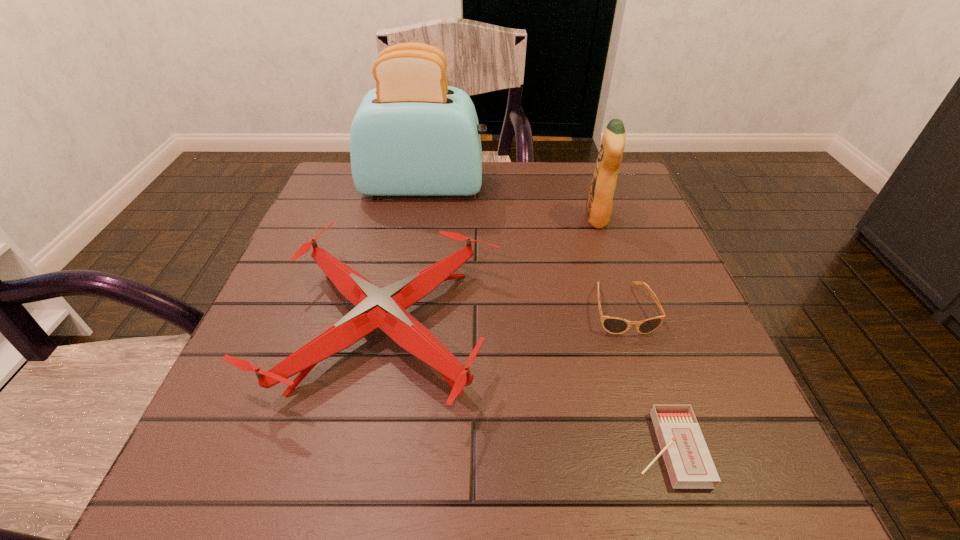
At what (x,y) coordinates should I click in order to perform the action: click on free space located 0.050m on the label of the second tallest object. Please return your answer as a coordinate pair (x, y). The image size is (960, 540). Looking at the image, I should click on (564, 218).

The height and width of the screenshot is (540, 960). What are the coordinates of `free region located on the back of the drone` in the screenshot? It's located at (411, 206).

Find the location of `blank space located on the front-facing side of the sunglasses`. blank space located on the front-facing side of the sunglasses is located at coordinates [682, 495].

This screenshot has height=540, width=960. I want to click on free space located on the striking surface of the matchbox, so click(493, 448).

Locate an element on the screen. vacant space located 0.230m on the striking surface of the matchbox is located at coordinates (472, 448).

You are a GUI agent. You are given a task and a screenshot of the screen. Output one action in this format:
    pyautogui.click(x=<x>, y=<y>)
    Task: Click on the blank area located 0.120m on the striking surface of the matchbox
    
    Given the screenshot: What is the action you would take?
    pyautogui.click(x=550, y=448)

Where is `toaster present at the far edge`? The image size is (960, 540). toaster present at the far edge is located at coordinates (413, 135).

Image resolution: width=960 pixels, height=540 pixels. Identify the location of detergent present at the far edge. (599, 202).

Locate an element on the screen. This screenshot has height=540, width=960. object present at the near edge is located at coordinates (688, 461).

Identify the location of toaster located at the left edge. This screenshot has width=960, height=540. (413, 135).